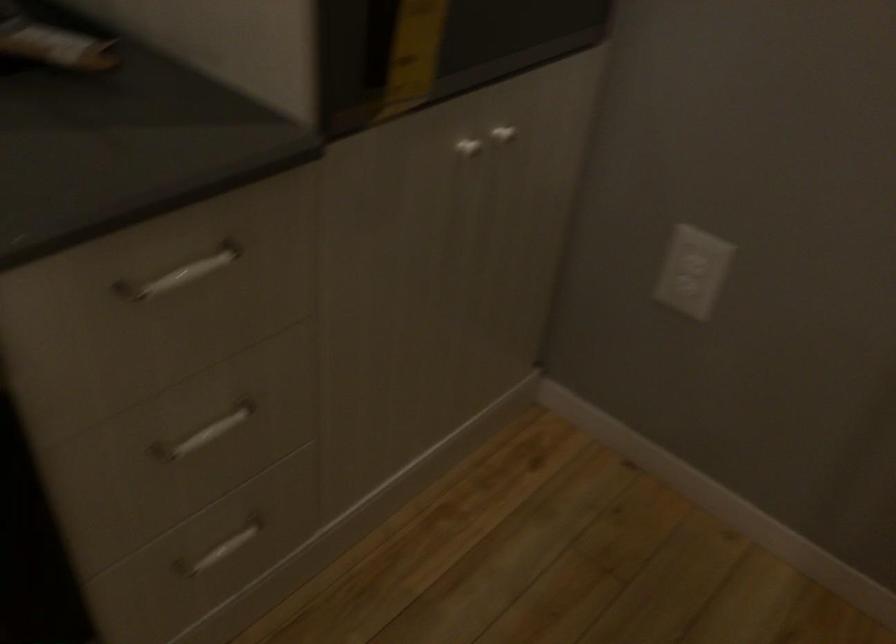
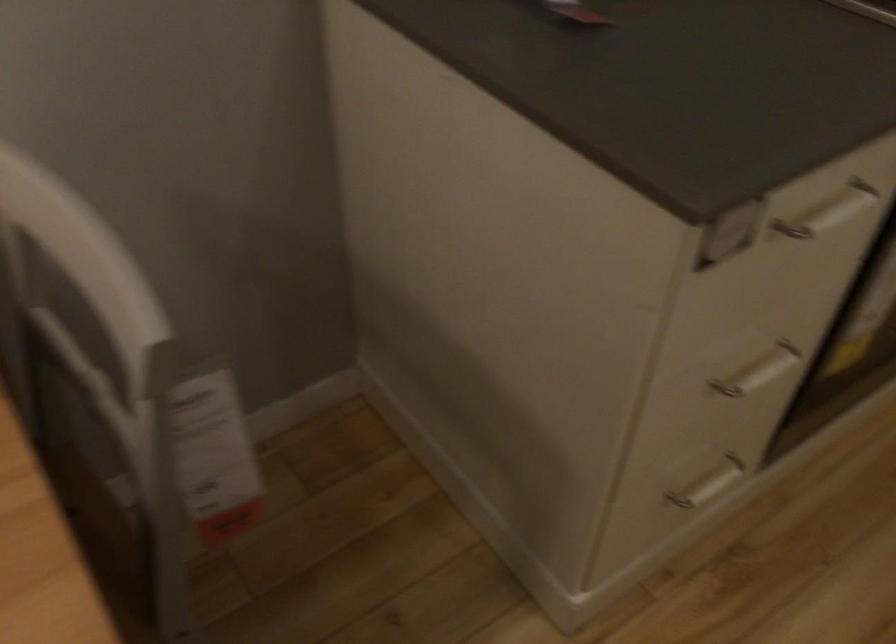
The images are taken continuously from a first-person perspective. In which direction are you moving?

The cameraman moved toward left, backward.